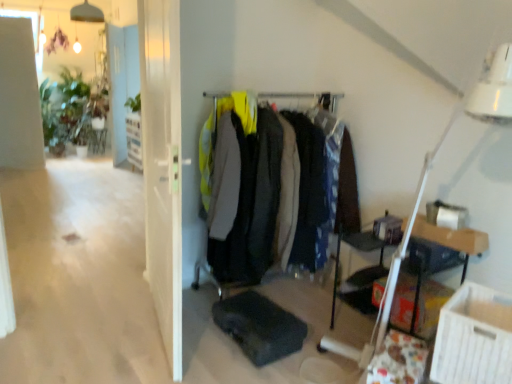
Where is `vacant space in front of transparent glass door at center`? vacant space in front of transparent glass door at center is located at coordinates (131, 362).